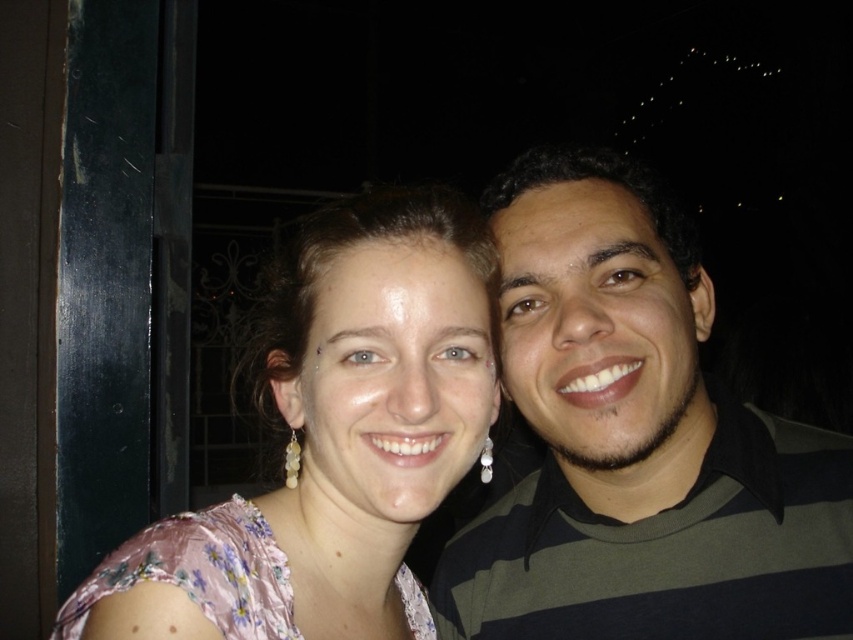
You are a photographer trying to capture a clear photo of both the striped cotton shirt at right and the pink floral dress at center. Since the background is dark, you need to adjust the camera focus. Which clothing item requires a larger focus area?

The striped cotton shirt at right requires a larger focus area because it is larger in size than the pink floral dress at center.

You are a photographer adjusting the focus on your camera. The camera is currently focused on the woman in the light pink floral dress. To ensure the striped cotton shirt at right is also in focus, where should you adjust the focus point to?

The striped cotton shirt at right is located at point (637, 442), so you should adjust the focus point to coordinates (637, 442) to ensure it is in focus.

You are standing in front of a photo of two people taken at night. The scene shows a striped cotton shirt at right and a pink floral dress at center. Which clothing item is positioned farther to the right?

The striped cotton shirt at right is positioned farther to the right than the pink floral dress at center.